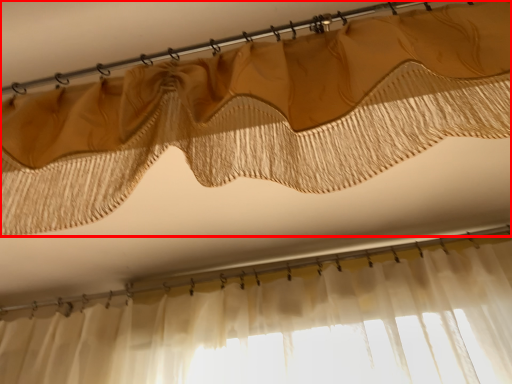
Question: Where is curtain (annotated by the red box) located in relation to clothesline in the image?

Choices:
 (A) left
 (B) right

Answer: (B)